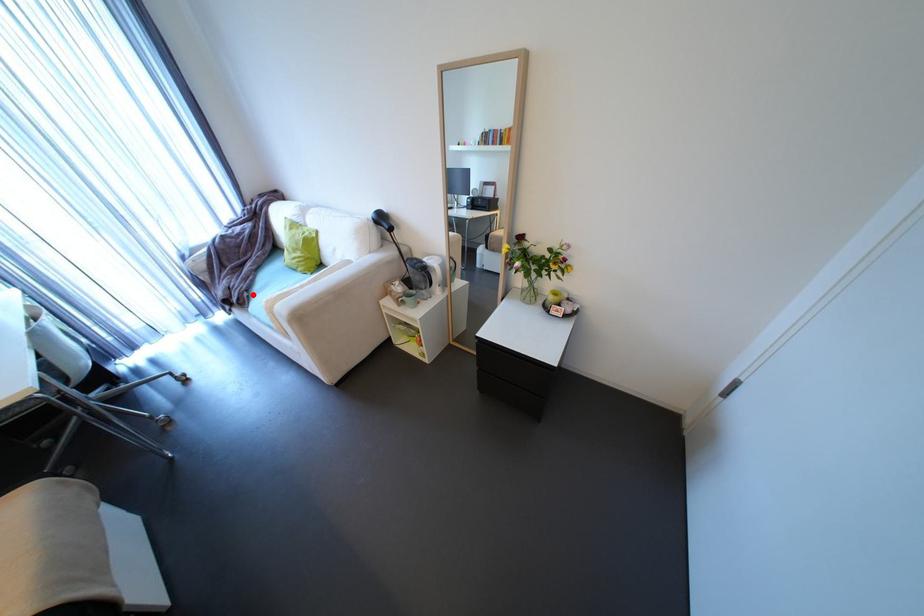
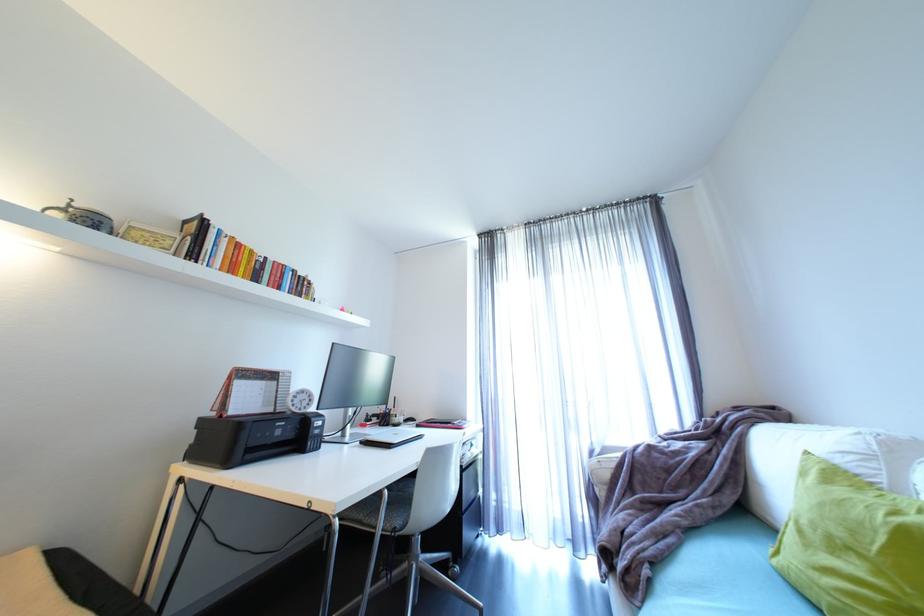
Question: I am providing you with two images of the same scene from different viewpoints. A red point is marked on the first image. At the location where the point appears in image 1, is it still visible in image 2?

Choices:
 (A) Yes
 (B) No

Answer: (A)